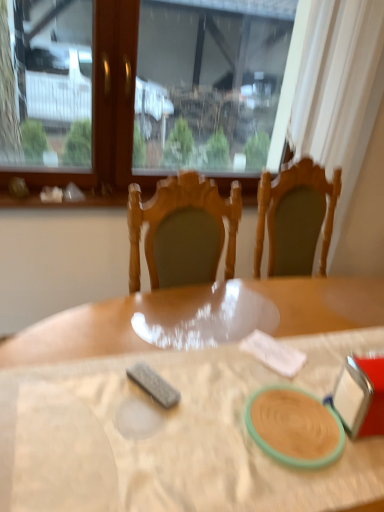
At what (x,y) coordinates should I click in order to perform the action: click on wooden table at center. Please return your answer as a coordinate pair (x, y). Looking at the image, I should click on (170, 435).

What do you see at coordinates (150, 90) in the screenshot?
I see `transparent glass window at upper center` at bounding box center [150, 90].

What do you see at coordinates (294, 426) in the screenshot?
I see `matte green plate at center` at bounding box center [294, 426].

You are a GUI agent. You are given a task and a screenshot of the screen. Output one action in this format:
    pyautogui.click(x=<x>, y=<y>)
    Task: Click on the wooden table at center
    
    Given the screenshot: What is the action you would take?
    pyautogui.click(x=170, y=435)

How many degrees apart are the facing directions of wooden table at center and matte green plate at center?

87.7 degrees.

Is point (58, 340) positioned after point (297, 435)?

That is True.

Does wooden table at center turn towards matte green plate at center?

No, wooden table at center does not turn towards matte green plate at center.

Considering the positions of objects wooden table at center and matte green plate at center in the image provided, who is behind, wooden table at center or matte green plate at center?

matte green plate at center is further away from the camera.

Which object is thinner, wooden table at center or transparent glass window at upper center?

transparent glass window at upper center.

Between wooden table at center and transparent glass window at upper center, which one appears on the right side from the viewer's perspective?

wooden table at center.

Is point (348, 343) in front of point (70, 121)?

Yes, point (348, 343) is in front of point (70, 121).

This screenshot has width=384, height=512. Identify the location of tableware beneath the transparent glass window at upper center (from a real-world perspective). (294, 426).

Which is more distant, (22, 94) or (271, 436)?

Point (22, 94)

Which object is further away from the camera taking this photo, transparent glass window at upper center or matte green plate at center?

Positioned behind is transparent glass window at upper center.

From a real-world perspective, is transparent glass window at upper center physically located above or below matte green plate at center?

From a real-world perspective, transparent glass window at upper center is physically above matte green plate at center.

Does transparent glass window at upper center lie behind wooden table at center?

Yes.

Is transparent glass window at upper center in contact with wooden table at center?

No, transparent glass window at upper center is not with wooden table at center.

Considering the relative sizes of transparent glass window at upper center and wooden table at center in the image provided, is transparent glass window at upper center bigger than wooden table at center?

No.

Find the location of a particular element. window behind the wooden table at center is located at coordinates (150, 90).

Between matte green plate at center and wooden table at center, which one has larger width?

Wider between the two is wooden table at center.

Considering the positions of point (326, 436) and point (203, 426), is point (326, 436) closer or farther from the camera than point (203, 426)?

Point (326, 436) is positioned farther from the camera compared to point (203, 426).

Considering the sizes of objects matte green plate at center and wooden table at center in the image provided, who is shorter, matte green plate at center or wooden table at center?

With less height is matte green plate at center.

Is matte green plate at center spatially inside wooden table at center, or outside of it?

matte green plate at center lies within the bounds of wooden table at center.

Is point (257, 431) more distant than point (40, 158)?

No, it is not.

The width and height of the screenshot is (384, 512). In order to click on tableware located below the transparent glass window at upper center (from the image's perspective) in this screenshot , I will do `click(294, 426)`.

Is there a large distance between matte green plate at center and transparent glass window at upper center?

matte green plate at center is far away from transparent glass window at upper center.

Locate an element on the screen. This screenshot has height=512, width=384. table below the matte green plate at center (from a real-world perspective) is located at coordinates (170, 435).

Where is `window above the wooden table at center (from the image's perspective)`? window above the wooden table at center (from the image's perspective) is located at coordinates (150, 90).

Which object lies further to the anchor point transparent glass window at upper center, matte green plate at center or wooden table at center?

matte green plate at center is further to transparent glass window at upper center.

Looking at the image, which one is located further to wooden table at center, matte green plate at center or transparent glass window at upper center?

transparent glass window at upper center lies further to wooden table at center than the other object.

Estimate the real-world distances between objects in this image. Which object is further from wooden table at center, transparent glass window at upper center or matte green plate at center?

transparent glass window at upper center lies further to wooden table at center than the other object.

Considering their positions, is transparent glass window at upper center positioned closer to matte green plate at center than wooden table at center?

The object closer to matte green plate at center is wooden table at center.

Looking at the image, which one is located closer to transparent glass window at upper center, wooden table at center or matte green plate at center?

Among the two, wooden table at center is located nearer to transparent glass window at upper center.

Which object lies nearer to the anchor point matte green plate at center, wooden table at center or transparent glass window at upper center?

wooden table at center is positioned closer to the anchor matte green plate at center.

Identify the location of tableware between transparent glass window at upper center and wooden table at center in the up-down direction. (294, 426).